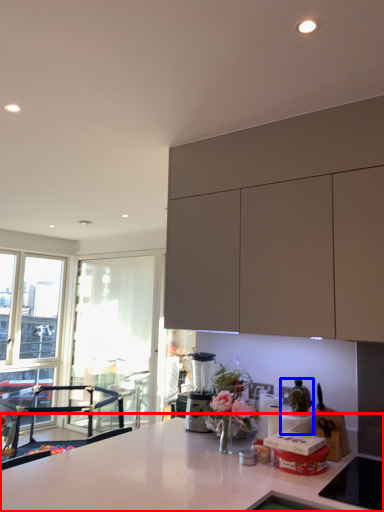
Question: Which object appears farthest to the camera in this image, countertop (highlighted by a red box) or appliance (highlighted by a blue box)?

Choices:
 (A) countertop
 (B) appliance

Answer: (B)